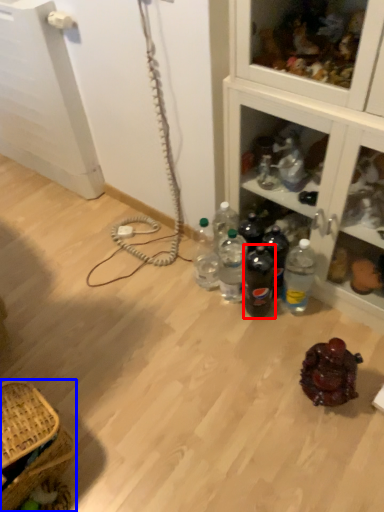
Question: Which object appears closest to the camera in this image, bottle (highlighted by a red box) or picnic basket (highlighted by a blue box)?

Choices:
 (A) bottle
 (B) picnic basket

Answer: (B)